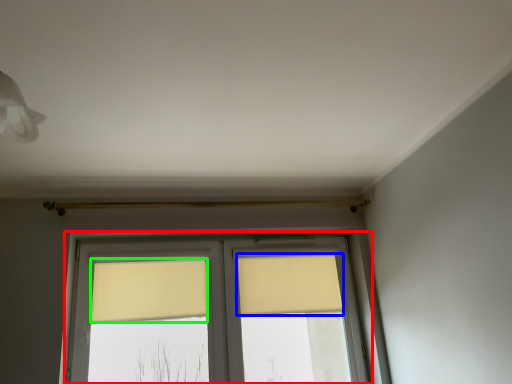
Question: Based on their relative distances, which object is farther from window (highlighted by a red box)? Choose from curtain (highlighted by a blue box) and curtain (highlighted by a green box).

Choices:
 (A) curtain
 (B) curtain

Answer: (B)